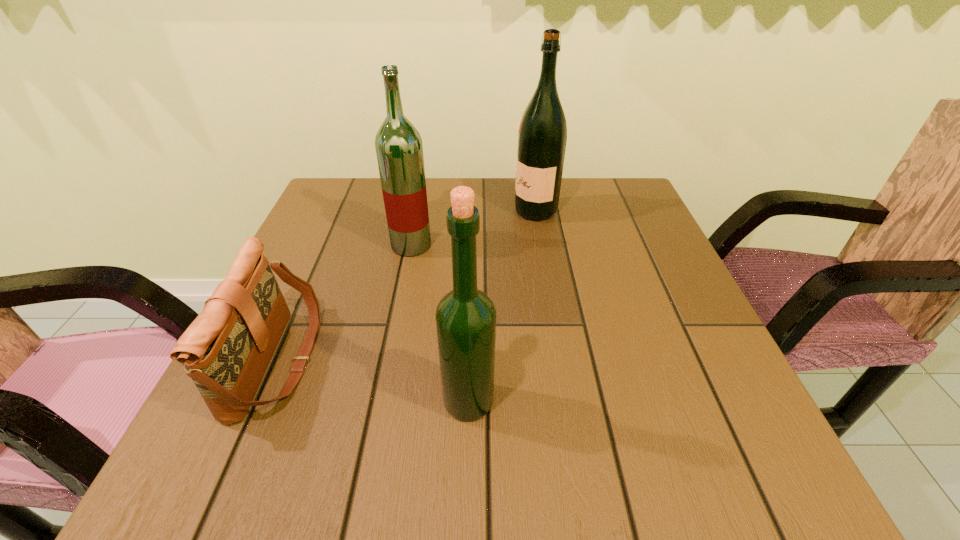
Where is `object that ranks as the closest to the rightmost liquor`? object that ranks as the closest to the rightmost liquor is located at coordinates [x=398, y=144].

At what (x,y) coordinates should I click in order to perform the action: click on object that is the second closest to the second nearest liquor. Please return your answer as a coordinate pair (x, y). The height and width of the screenshot is (540, 960). Looking at the image, I should click on (542, 136).

The image size is (960, 540). I want to click on liquor that is the second closest one to the leftmost liquor, so click(x=465, y=317).

Locate an element on the screen. This screenshot has width=960, height=540. liquor that is the second nearest to the second nearest liquor is located at coordinates (465, 317).

I want to click on vacant space that satisfies the following two spatial constraints: 1. on the front side of the nearest liquor; 2. on the left side of the leftmost liquor, so click(381, 401).

Identify the location of vacant space that satisfies the following two spatial constraints: 1. on the front-facing side of the leftmost object; 2. on the back side of the second liquor from left to right. (261, 401).

Where is `vacant region that satisfies the following two spatial constraints: 1. on the front side of the third object from left to right; 2. on the left side of the third object from right to left`? vacant region that satisfies the following two spatial constraints: 1. on the front side of the third object from left to right; 2. on the left side of the third object from right to left is located at coordinates (381, 401).

Locate an element on the screen. The image size is (960, 540). free location that satisfies the following two spatial constraints: 1. on the front-facing side of the leftmost object; 2. on the left side of the nearest liquor is located at coordinates pos(261,401).

This screenshot has height=540, width=960. Find the location of `vacant position in the image that satisfies the following two spatial constraints: 1. on the front-facing side of the leftmost object; 2. on the back side of the nearest liquor`. vacant position in the image that satisfies the following two spatial constraints: 1. on the front-facing side of the leftmost object; 2. on the back side of the nearest liquor is located at coordinates (261, 401).